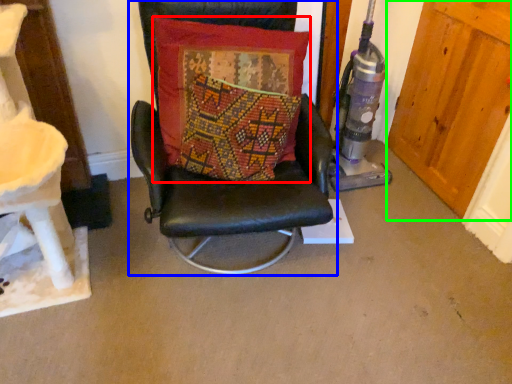
Question: Estimate the real-world distances between objects in this image. Which object is farther from pillow (highlighted by a red box), chair (highlighted by a blue box) or door (highlighted by a green box)?

Choices:
 (A) chair
 (B) door

Answer: (B)